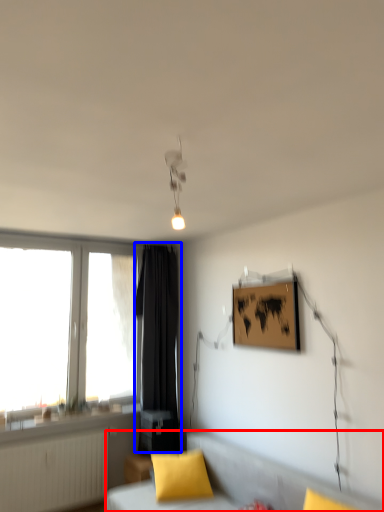
Question: Which of the following is the closest to the observer, furniture (highlighted by a red box) or curtain (highlighted by a blue box)?

Choices:
 (A) furniture
 (B) curtain

Answer: (A)